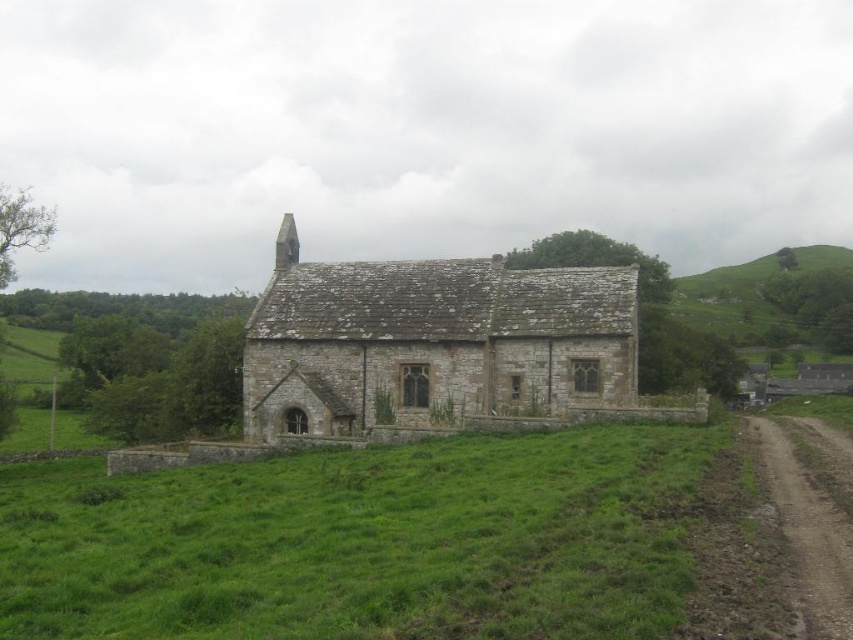
Question: Is stone textured church at center bigger than brown dirt track at lower right?

Choices:
 (A) yes
 (B) no

Answer: (A)

Question: Which of the following is the closest to the observer?

Choices:
 (A) click(345, 433)
 (B) click(747, 317)
 (C) click(804, 520)

Answer: (C)

Question: Can you confirm if stone textured church at center is wider than brown dirt track at lower right?

Choices:
 (A) no
 (B) yes

Answer: (B)

Question: Based on their relative distances, which object is farther from the green grassy hillside at upper right?

Choices:
 (A) brown dirt track at lower right
 (B) stone textured church at center

Answer: (A)

Question: Which of the following is the farthest from the observer?

Choices:
 (A) stone textured church at center
 (B) brown dirt track at lower right
 (C) green grassy hillside at upper right

Answer: (C)

Question: Is stone textured church at center above green grassy hillside at upper right?

Choices:
 (A) no
 (B) yes

Answer: (A)